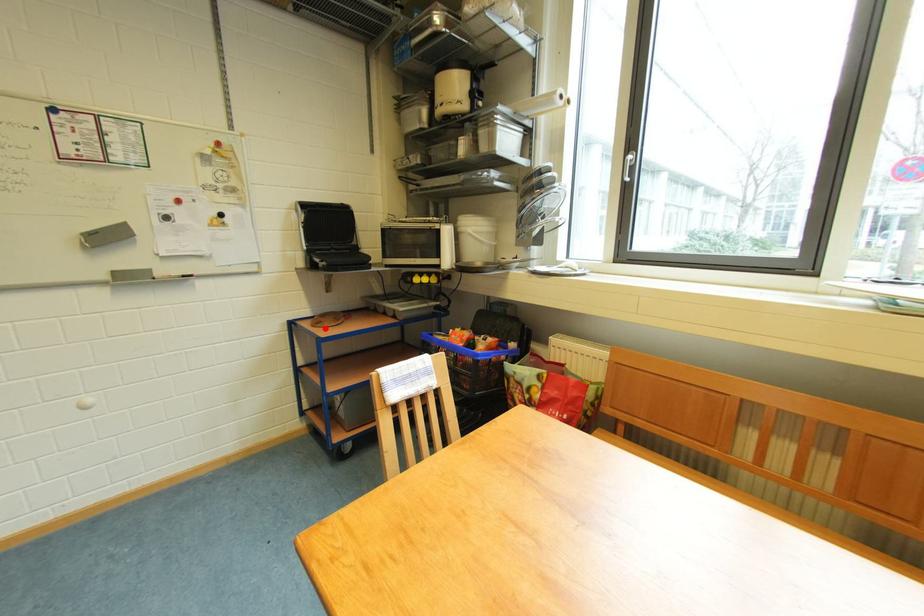
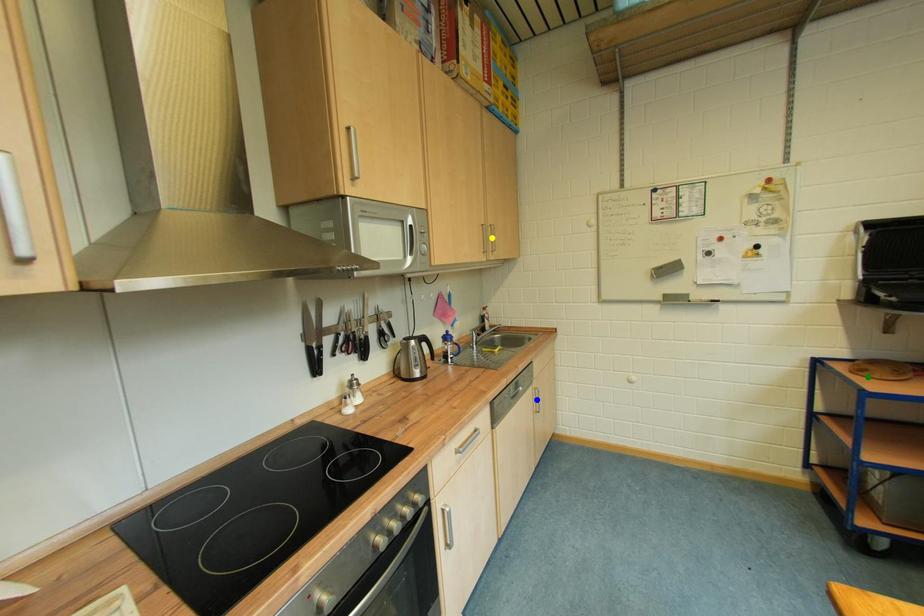
Question: I am providing you with two images of the same scene from different viewpoints. A red point is marked on the first image. You are given multiple points on the second image. Which mark in image 2 goes with the point in image 1?

Choices:
 (A) blue point
 (B) green point
 (C) yellow point

Answer: (B)